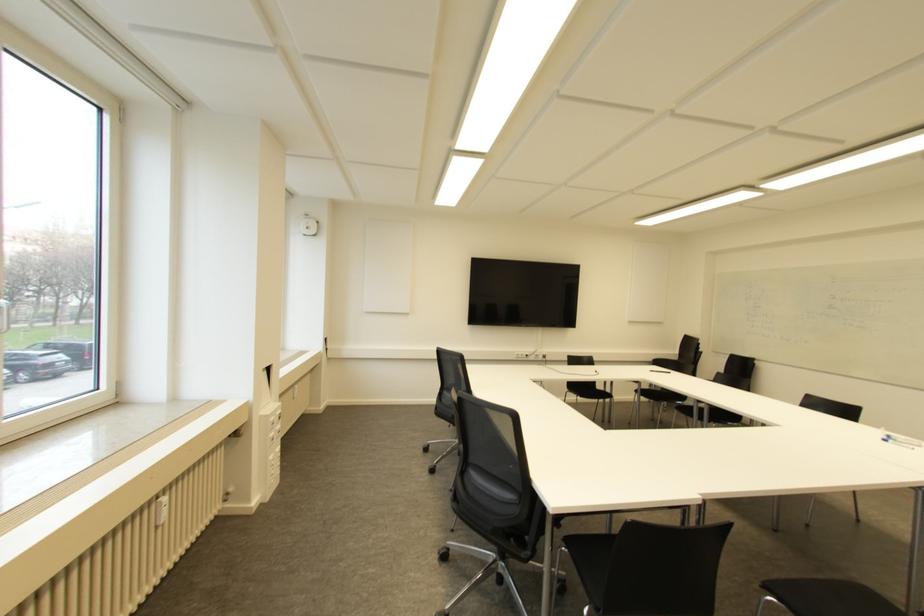
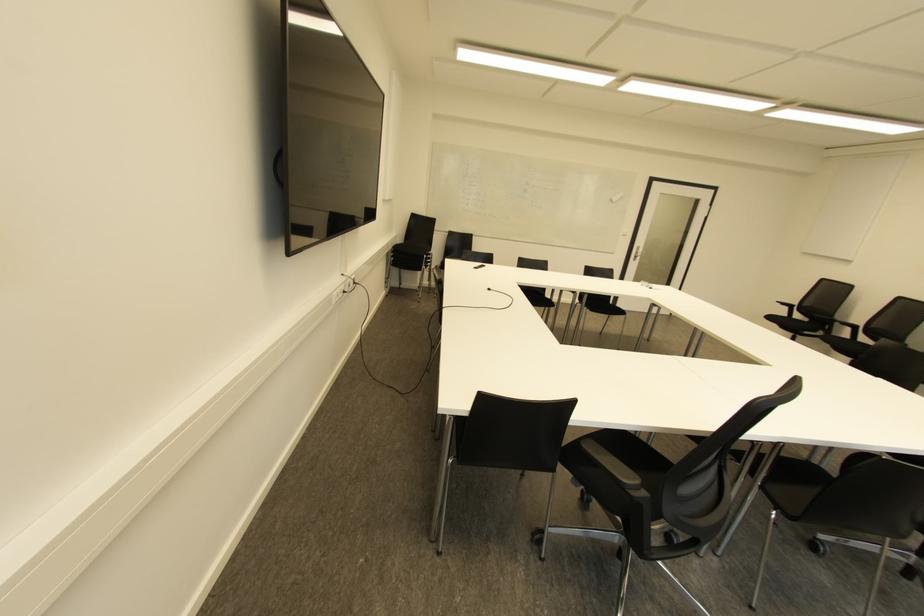
The point at (543, 355) is marked in the first image. Where is the corresponding point in the second image?

(354, 282)